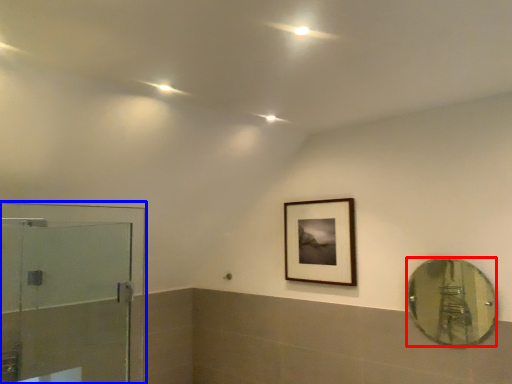
Question: Which point is further to the camera, mirror (highlighted by a red box) or screen door (highlighted by a blue box)?

Choices:
 (A) mirror
 (B) screen door

Answer: (A)